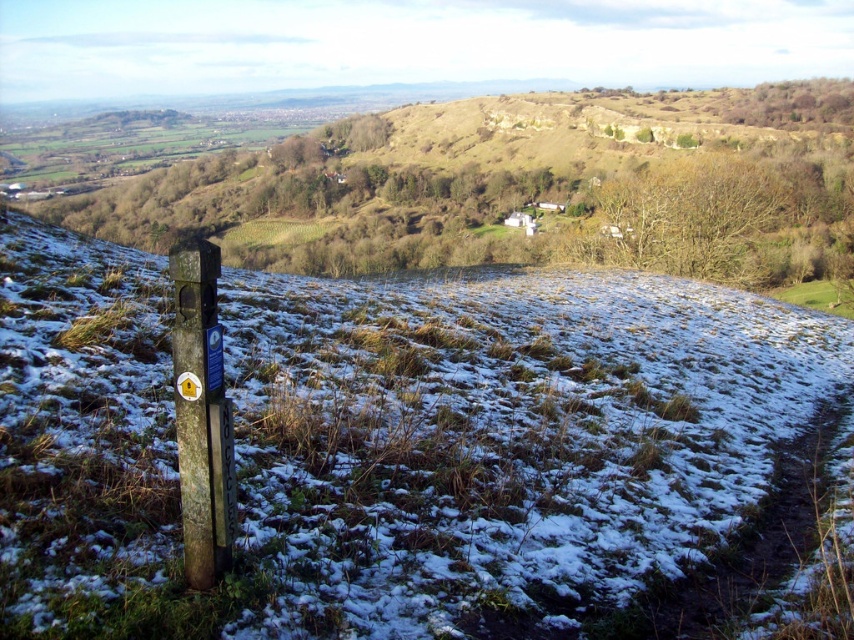
In the scene shown: Is green grass at center bigger than dark brown wooden post at lower left?

Correct, green grass at center is larger in size than dark brown wooden post at lower left.

Does green grass at center have a smaller size compared to dark brown wooden post at lower left?

No.

Image resolution: width=854 pixels, height=640 pixels. Describe the element at coordinates (384, 442) in the screenshot. I see `green grass at center` at that location.

Identify the location of green grass at center. The image size is (854, 640). (384, 442).